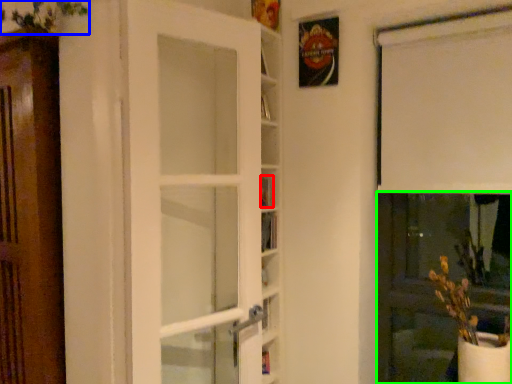
Question: Based on their relative distances, which object is farther from book (highlighted by a red box)? Choose from plant (highlighted by a blue box) and screen door (highlighted by a green box).

Choices:
 (A) plant
 (B) screen door

Answer: (B)